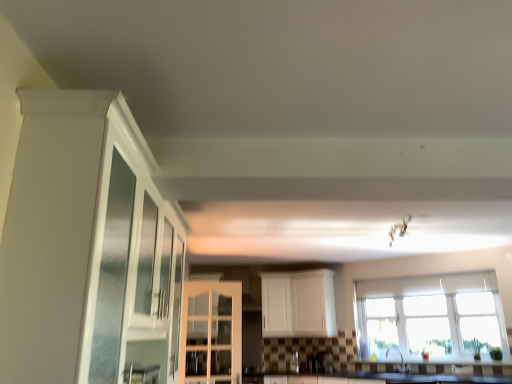
Question: Which direction should I rotate to face white matte cabinet at center, which is counted as the 1th cabinetry, starting from the back, — up or down?

Choices:
 (A) up
 (B) down

Answer: (B)

Question: Does clear glass window at center lie behind white glossy cabinet at left, positioned as the 1th cabinetry in front-to-back order?

Choices:
 (A) yes
 (B) no

Answer: (A)

Question: Is clear glass window at center at the right side of white glossy cabinet at left, acting as the third cabinetry starting from the back?

Choices:
 (A) no
 (B) yes

Answer: (B)

Question: Is clear glass window at center looking in the opposite direction of white glossy cabinet at left, acting as the third cabinetry starting from the back?

Choices:
 (A) no
 (B) yes

Answer: (A)

Question: Is clear glass window at center located outside white glossy cabinet at left, positioned as the 1th cabinetry in front-to-back order?

Choices:
 (A) no
 (B) yes

Answer: (B)

Question: Is clear glass window at center to the left of white glossy cabinet at left, acting as the third cabinetry starting from the back, from the viewer's perspective?

Choices:
 (A) yes
 (B) no

Answer: (B)

Question: From a real-world perspective, does clear glass window at center sit lower than white glossy cabinet at left, acting as the third cabinetry starting from the back?

Choices:
 (A) yes
 (B) no

Answer: (A)

Question: Can you confirm if clear glass window at center is positioned to the left of white glossy cabinet at center, the second cabinetry in the back-to-front sequence?

Choices:
 (A) no
 (B) yes

Answer: (A)

Question: Considering the relative sizes of clear glass window at center and white glossy cabinet at center, marked as the second cabinetry in a front-to-back arrangement, in the image provided, is clear glass window at center shorter than white glossy cabinet at center, marked as the second cabinetry in a front-to-back arrangement,?

Choices:
 (A) no
 (B) yes

Answer: (B)

Question: Does clear glass window at center have a greater height compared to white glossy cabinet at center, the second cabinetry in the back-to-front sequence?

Choices:
 (A) yes
 (B) no

Answer: (B)

Question: Considering the relative positions of clear glass window at center and white glossy cabinet at center, the second cabinetry in the back-to-front sequence, in the image provided, is clear glass window at center behind white glossy cabinet at center, the second cabinetry in the back-to-front sequence,?

Choices:
 (A) yes
 (B) no

Answer: (A)

Question: Is clear glass window at center smaller than white glossy cabinet at center, marked as the second cabinetry in a front-to-back arrangement?

Choices:
 (A) no
 (B) yes

Answer: (A)

Question: Is clear glass window at center wider than white glossy cabinet at center, marked as the second cabinetry in a front-to-back arrangement?

Choices:
 (A) yes
 (B) no

Answer: (A)

Question: Can you confirm if metallic glass bottle at center is smaller than satin nickel faucet at lower center?

Choices:
 (A) no
 (B) yes

Answer: (B)